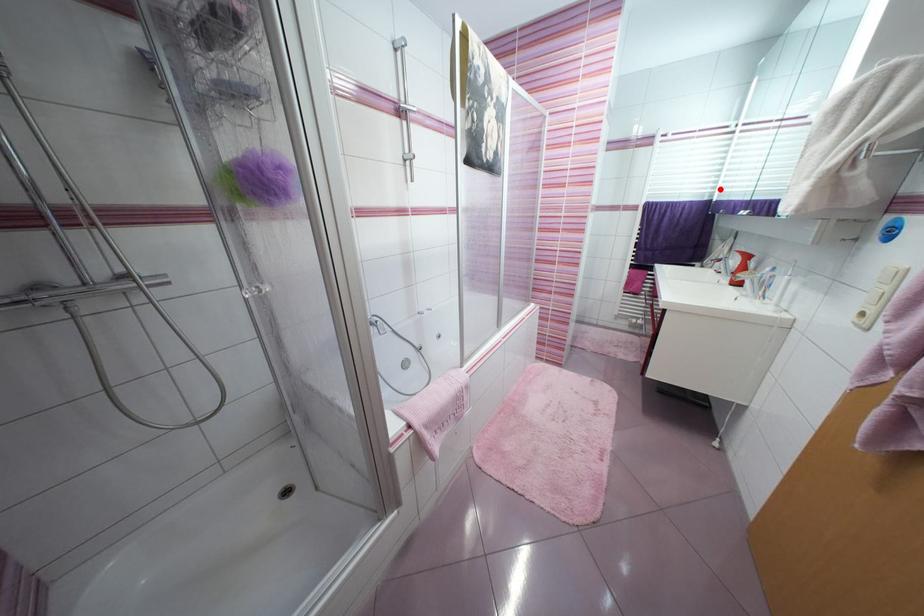
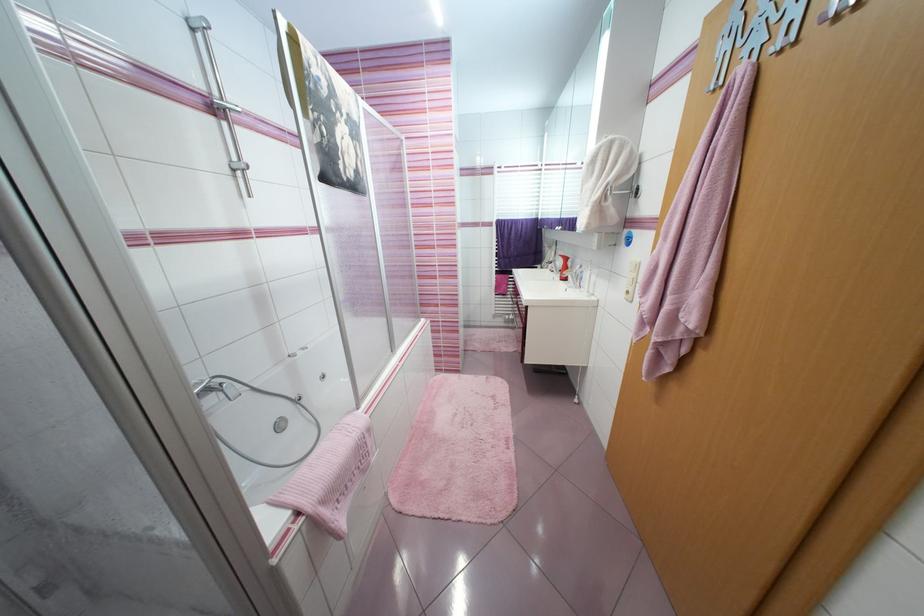
Question: I am providing you with two images of the same scene from different viewpoints. A red point is shown in image1. For the corresponding object point in image2, is it positioned nearer or farther from the camera?

Choices:
 (A) Nearer
 (B) Farther

Answer: (A)